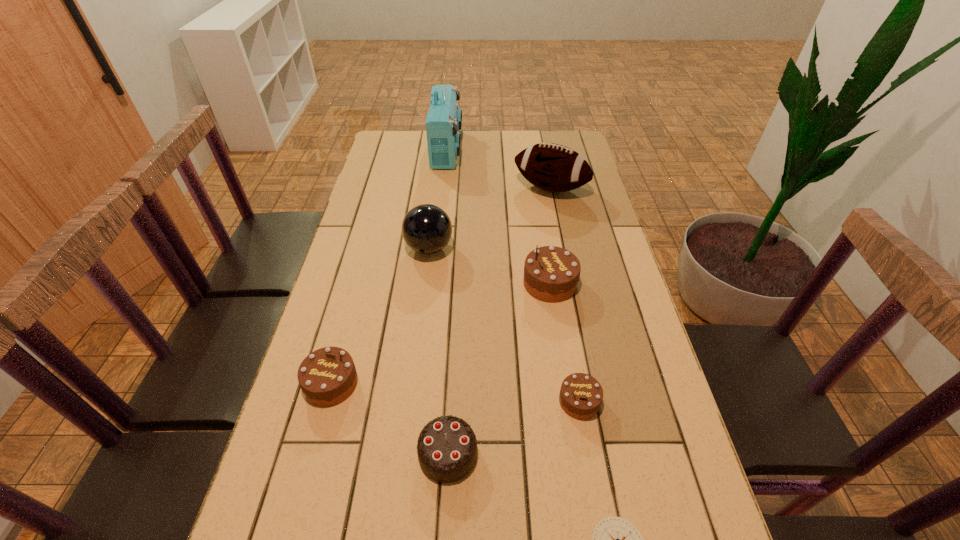
The height and width of the screenshot is (540, 960). Identify the location of object that is at the far edge. (443, 122).

Locate an element on the screen. Image resolution: width=960 pixels, height=540 pixels. object that is at the left edge is located at coordinates (327, 376).

The height and width of the screenshot is (540, 960). In order to click on football (American) present at the right edge in this screenshot , I will do point(552,167).

This screenshot has height=540, width=960. I want to click on vacant space at the far edge of the desktop, so click(504, 154).

Locate an element on the screen. This screenshot has width=960, height=540. free space at the left edge is located at coordinates (337, 266).

Where is `free region at the right edge`? free region at the right edge is located at coordinates (612, 249).

In the image, there is a desktop. At what (x,y) coordinates should I click in order to perform the action: click on free space at the far right corner. Please return your answer as a coordinate pair (x, y). This screenshot has height=540, width=960. Looking at the image, I should click on (546, 131).

Identify the location of unoccupied position between the smallest brown chocolate cake and the second biggest brown chocolate cake. (455, 392).

Find the location of a particular element. This screenshot has height=540, width=960. free space between the blue radio receiver and the farthest chocolate cake is located at coordinates (498, 216).

This screenshot has width=960, height=540. Identify the location of free spot between the seventh nearest object and the tallest chocolate cake. (550, 236).